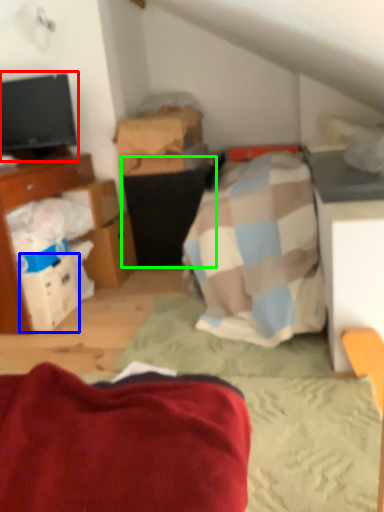
Question: Based on their relative distances, which object is nearer to television (highlighted by a red box)? Choose from box (highlighted by a blue box) and vanity (highlighted by a green box).

Choices:
 (A) box
 (B) vanity

Answer: (B)